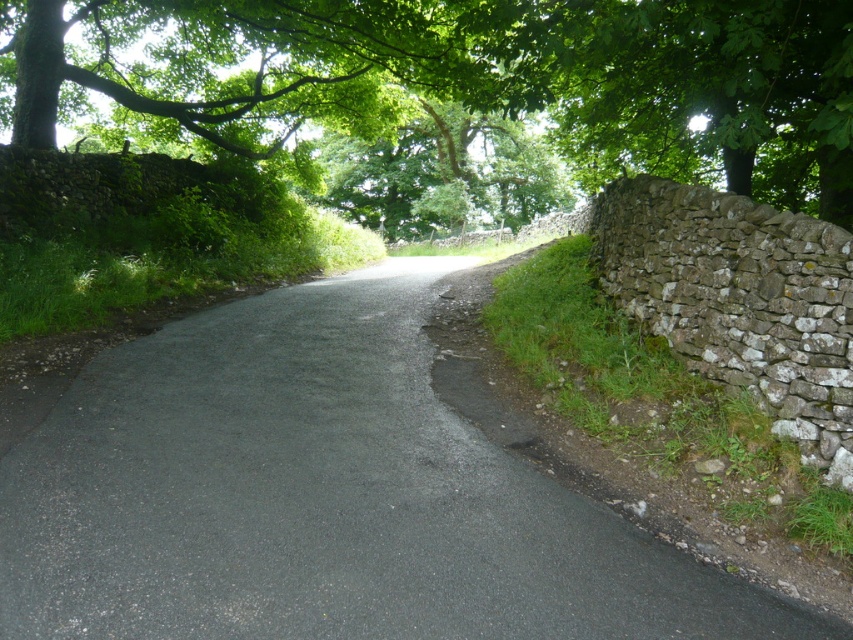
Does asphalt road at center appear over green leafy tree at upper left?

No, asphalt road at center is not above green leafy tree at upper left.

Does asphalt road at center appear on the right side of green leafy tree at upper left?

Yes, asphalt road at center is to the right of green leafy tree at upper left.

This screenshot has height=640, width=853. I want to click on asphalt road at center, so click(x=321, y=497).